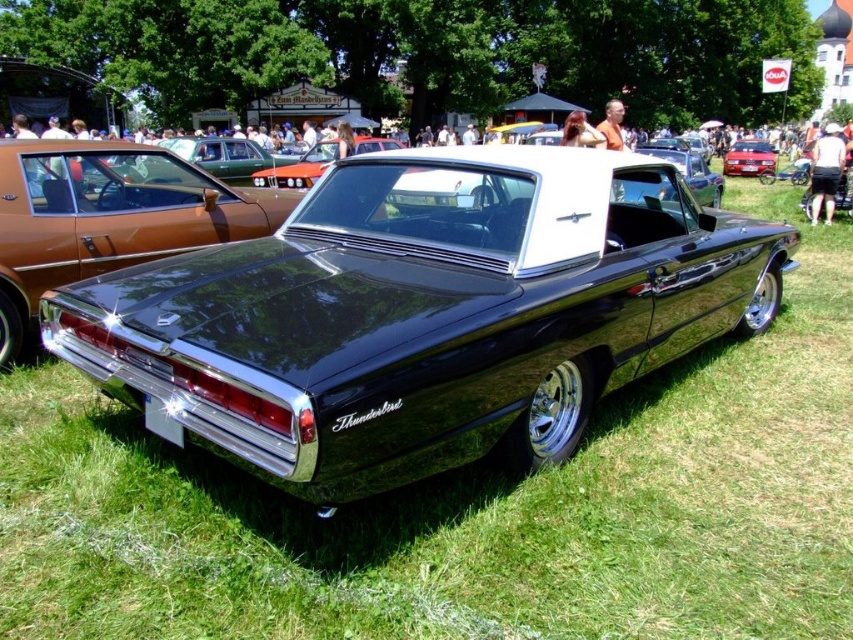
In the scene shown: Which is above, shiny black thunderbird at center or metallic red car at center?

metallic red car at center is higher up.

Can you confirm if shiny black thunderbird at center is smaller than metallic red car at center?

Actually, shiny black thunderbird at center might be larger than metallic red car at center.

What do you see at coordinates (422, 314) in the screenshot?
I see `shiny black thunderbird at center` at bounding box center [422, 314].

The image size is (853, 640). In order to click on shiny black thunderbird at center in this screenshot , I will do `click(422, 314)`.